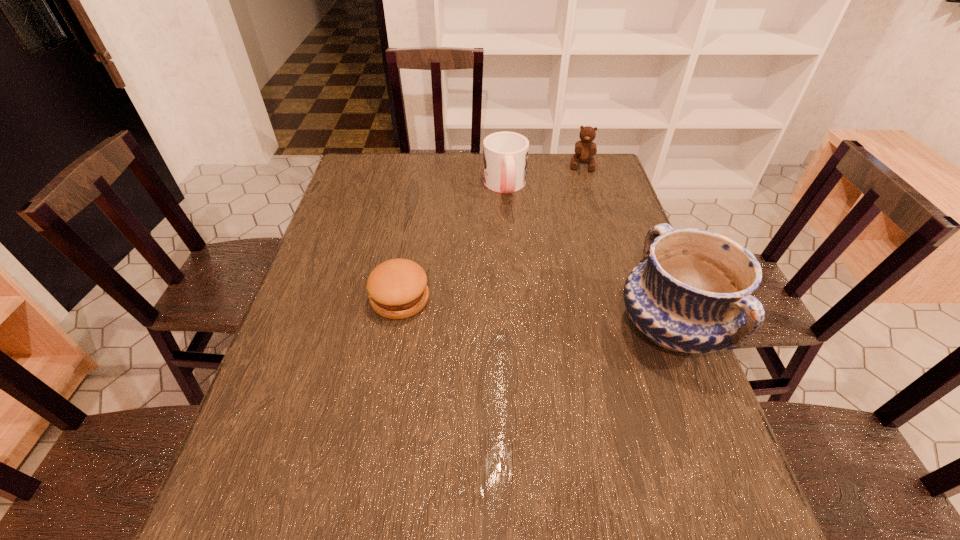
At what (x,y) coordinates should I click in order to perform the action: click on vacant space at the left edge of the desktop. Please return your answer as a coordinate pair (x, y). The image size is (960, 540). Looking at the image, I should click on (368, 247).

Locate an element on the screen. The width and height of the screenshot is (960, 540). blank area at the right edge is located at coordinates (588, 191).

Where is `blank area at the far left corner`? Image resolution: width=960 pixels, height=540 pixels. blank area at the far left corner is located at coordinates (388, 160).

You are a GUI agent. You are given a task and a screenshot of the screen. Output one action in this format:
    pyautogui.click(x=<x>, y=<y>)
    Task: Click on the vacant region at the near left corner of the desktop
    
    Given the screenshot: What is the action you would take?
    pyautogui.click(x=228, y=481)

This screenshot has width=960, height=540. I want to click on vacant area at the far right corner, so click(577, 174).

At what (x,y) coordinates should I click in order to perform the action: click on vacant space that is in between the teddy bear and the pottery. Please return your answer as a coordinate pair (x, y). The image size is (960, 540). Looking at the image, I should click on pos(627,246).

The height and width of the screenshot is (540, 960). I want to click on unoccupied position between the second object from left to right and the tallest object, so click(x=588, y=256).

This screenshot has width=960, height=540. I want to click on vacant area between the hamburger and the teddy bear, so click(x=491, y=233).

Identify the location of free space that is in between the shortest object and the tallest object. (536, 313).

Image resolution: width=960 pixels, height=540 pixels. Identify the location of free space between the teddy bear and the leftmost object. (491, 233).